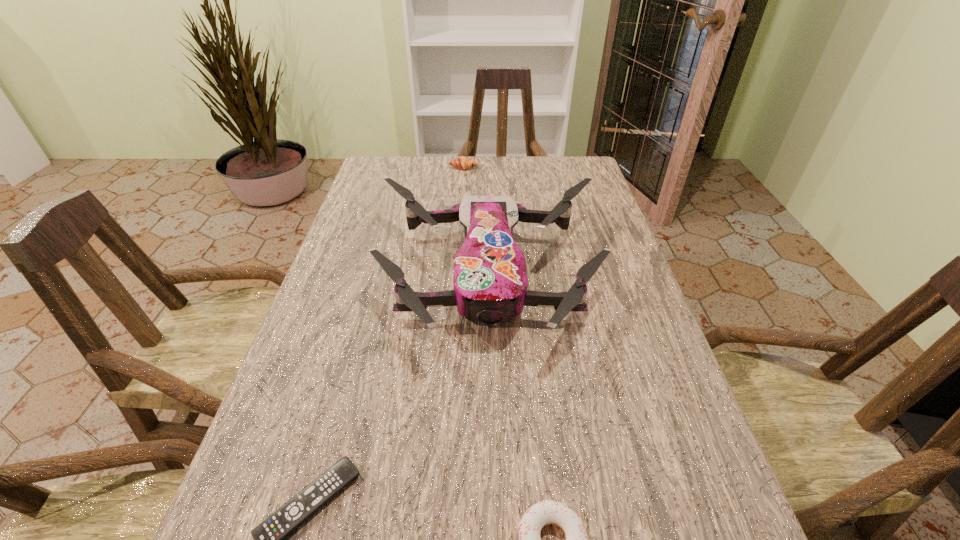
Where is `the third nearest object`? the third nearest object is located at coordinates (490, 283).

This screenshot has height=540, width=960. What are the coordinates of `the tallest object` in the screenshot? It's located at (490, 283).

This screenshot has height=540, width=960. I want to click on pastry, so (464, 163).

You are a GUI agent. You are given a task and a screenshot of the screen. Output one action in this format:
    pyautogui.click(x=<x>, y=<y>)
    Task: Click on the third shortest object
    
    Given the screenshot: What is the action you would take?
    pyautogui.click(x=464, y=163)

Identify the location of vacant space located 0.130m on the front-facing side of the tallest object. (492, 426).

The image size is (960, 540). I want to click on vacant space located on the front-facing side of the pastry, so click(461, 228).

Where is `object that is at the far edge`? The width and height of the screenshot is (960, 540). object that is at the far edge is located at coordinates (464, 163).

You are a GUI agent. You are given a task and a screenshot of the screen. Output one action in this format:
    pyautogui.click(x=<x>, y=<y>)
    Task: Click on the object at the left edge
    The image size is (960, 540).
    Given the screenshot: What is the action you would take?
    pyautogui.click(x=490, y=283)

This screenshot has height=540, width=960. Find the location of `object positioned at the right edge`. object positioned at the right edge is located at coordinates (490, 283).

The width and height of the screenshot is (960, 540). I want to click on blank space at the far edge, so click(x=497, y=189).